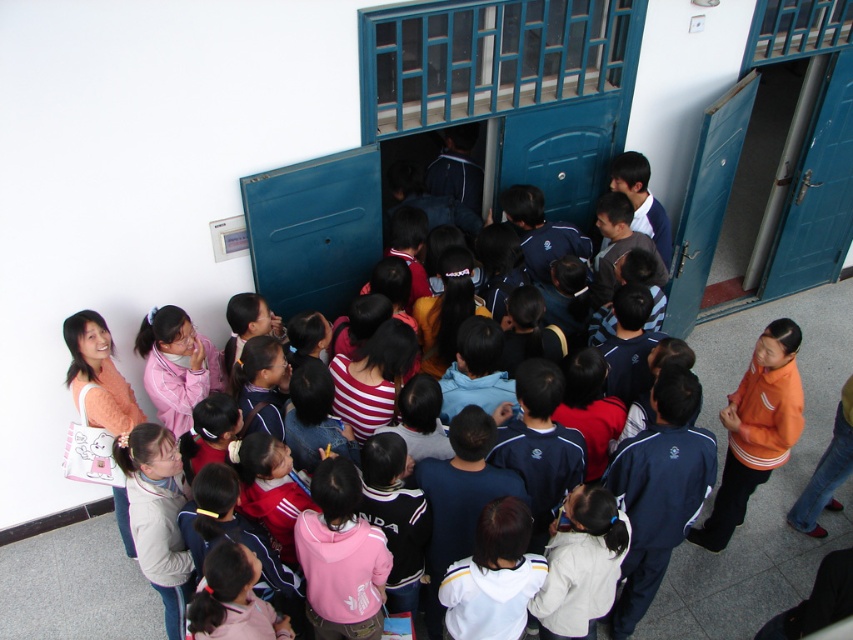
Does blue matte door at center have a greater height compared to pink fabric shirt at lower left?

Correct, blue matte door at center is much taller as pink fabric shirt at lower left.

You are a GUI agent. You are given a task and a screenshot of the screen. Output one action in this format:
    pyautogui.click(x=<x>, y=<y>)
    Task: Click on the blue matte door at center
    
    Given the screenshot: What is the action you would take?
    click(x=560, y=154)

Who is more forward, (x=515, y=161) or (x=248, y=593)?

Point (x=248, y=593)

Where is `blue matte door at center`? The width and height of the screenshot is (853, 640). blue matte door at center is located at coordinates (560, 154).

Which is more to the right, navy blue tracksuit at center or blue matte door at center?

navy blue tracksuit at center is more to the right.

Does navy blue tracksuit at center appear under blue matte door at center?

Correct, navy blue tracksuit at center is located below blue matte door at center.

Where is `navy blue tracksuit at center`? This screenshot has height=640, width=853. navy blue tracksuit at center is located at coordinates (656, 506).

Find the location of a particular element. blue painted wood door at right is located at coordinates (817, 193).

Who is shorter, blue painted wood door at right or blue matte door at center?

With less height is blue matte door at center.

Who is more distant from viewer, (x=846, y=100) or (x=520, y=144)?

The point (x=846, y=100) is more distant.

Locate an element on the screen. This screenshot has width=853, height=640. blue painted wood door at right is located at coordinates click(817, 193).